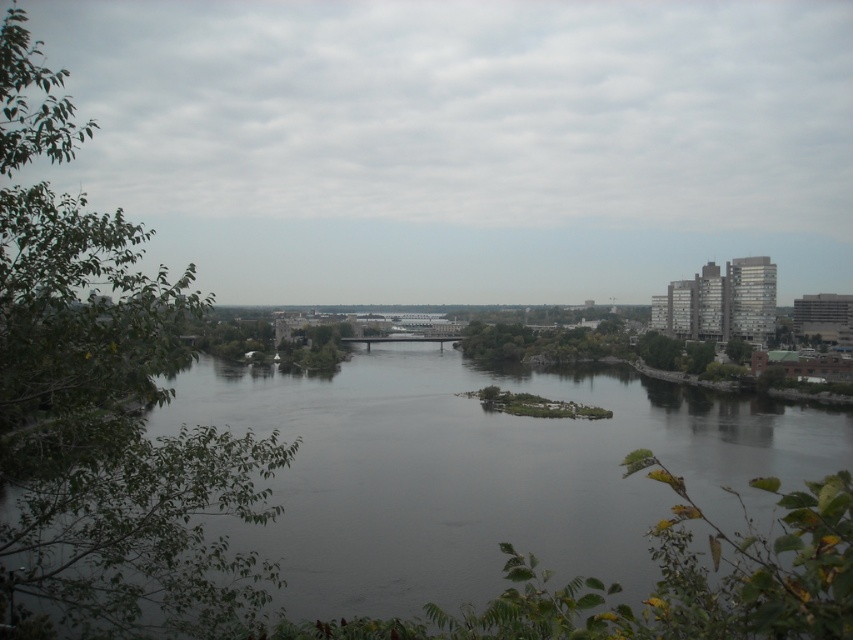
Can you confirm if dark gray water at center is shorter than green leafy tree at left?

Indeed, dark gray water at center has a lesser height compared to green leafy tree at left.

Does dark gray water at center have a larger size compared to green leafy tree at left?

No, dark gray water at center is not bigger than green leafy tree at left.

Is point (183, 394) closer to camera compared to point (68, 621)?

No.

Where is `dark gray water at center`? The height and width of the screenshot is (640, 853). dark gray water at center is located at coordinates (480, 472).